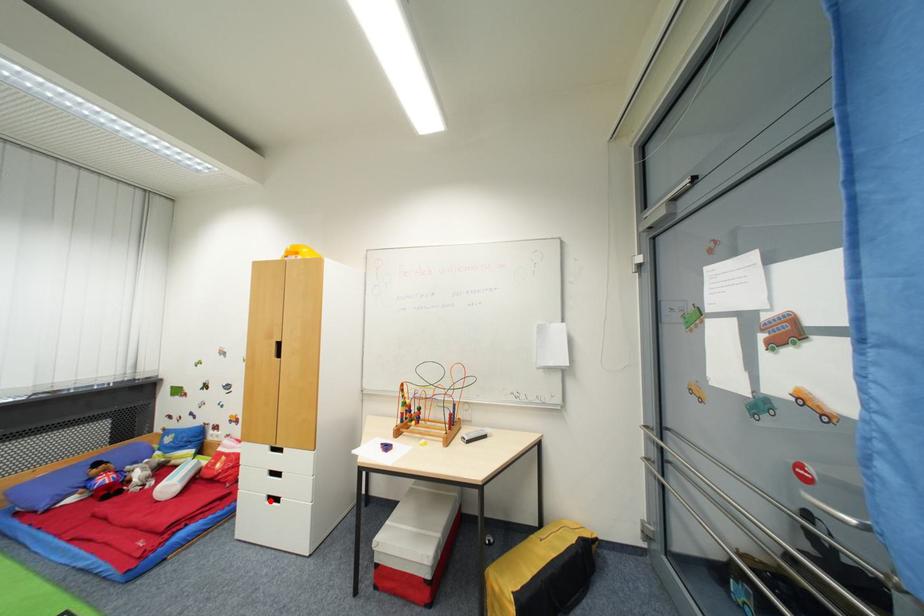
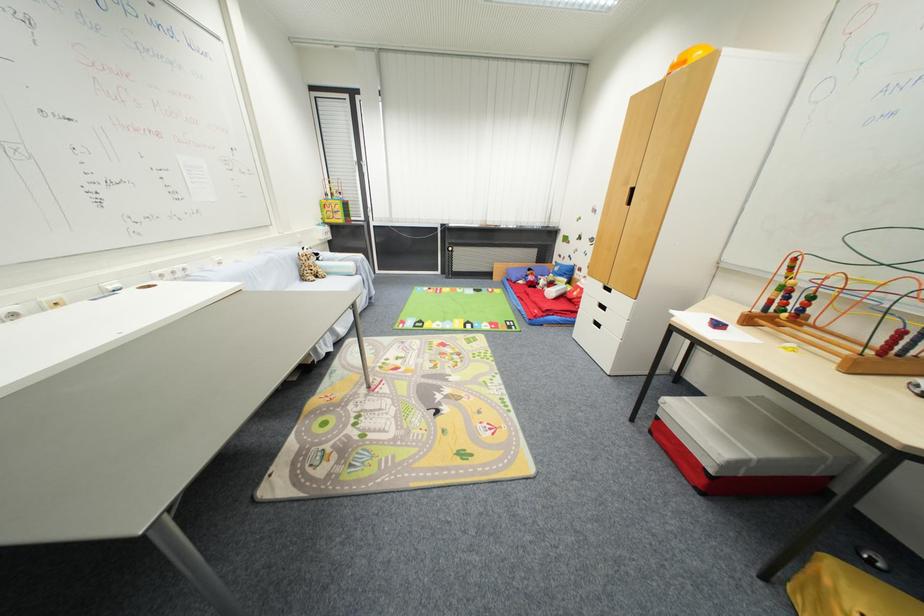
Locate, in the second image, the point that corresponds to the highlighted location in the first image.

(598, 323)